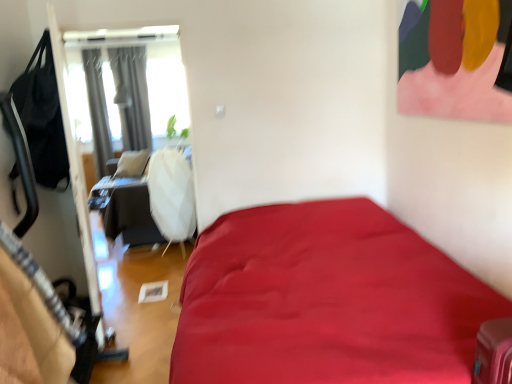
Question: Choose the correct answer: Is gray fabric curtain at upper left, the first curtain positioned from the left, inside gray fabric curtain at upper left, positioned as the 2th curtain in left-to-right order, or outside it?

Choices:
 (A) inside
 (B) outside

Answer: (B)

Question: Considering the positions of gray fabric curtain at upper left, marked as the 2th curtain in a right-to-left arrangement, and gray fabric curtain at upper left, positioned as the 2th curtain in left-to-right order, in the image, is gray fabric curtain at upper left, marked as the 2th curtain in a right-to-left arrangement, bigger or smaller than gray fabric curtain at upper left, positioned as the 2th curtain in left-to-right order,?

Choices:
 (A) small
 (B) big

Answer: (A)

Question: Looking at their shapes, would you say gray fabric curtain at upper left, marked as the 2th curtain in a right-to-left arrangement, is wider or thinner than gray fabric curtain at upper left, positioned as the 2th curtain in left-to-right order?

Choices:
 (A) wide
 (B) thin

Answer: (A)

Question: Is gray fabric curtain at upper left, positioned as the 2th curtain in left-to-right order, inside the boundaries of gray fabric curtain at upper left, marked as the 2th curtain in a right-to-left arrangement, or outside?

Choices:
 (A) outside
 (B) inside

Answer: (A)

Question: Considering the positions of gray fabric curtain at upper left, the 1th curtain viewed from the right, and gray fabric curtain at upper left, the first curtain positioned from the left, in the image, is gray fabric curtain at upper left, the 1th curtain viewed from the right, taller or shorter than gray fabric curtain at upper left, the first curtain positioned from the left,?

Choices:
 (A) tall
 (B) short

Answer: (B)

Question: From the image's perspective, is gray fabric curtain at upper left, the 1th curtain viewed from the right, positioned above or below gray fabric curtain at upper left, marked as the 2th curtain in a right-to-left arrangement?

Choices:
 (A) above
 (B) below

Answer: (A)

Question: Would you say gray fabric curtain at upper left, the 1th curtain viewed from the right, is to the left or to the right of gray fabric curtain at upper left, the first curtain positioned from the left, in the picture?

Choices:
 (A) right
 (B) left

Answer: (A)